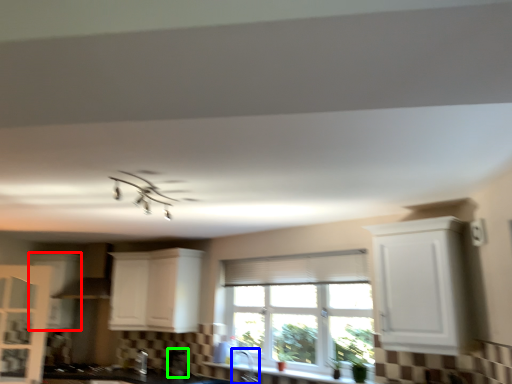
Question: Considering the real-world distances, which object is closest to cabinetry (highlighted by a red box)? faucet (highlighted by a blue box) or appliance (highlighted by a green box).

Choices:
 (A) faucet
 (B) appliance

Answer: (B)